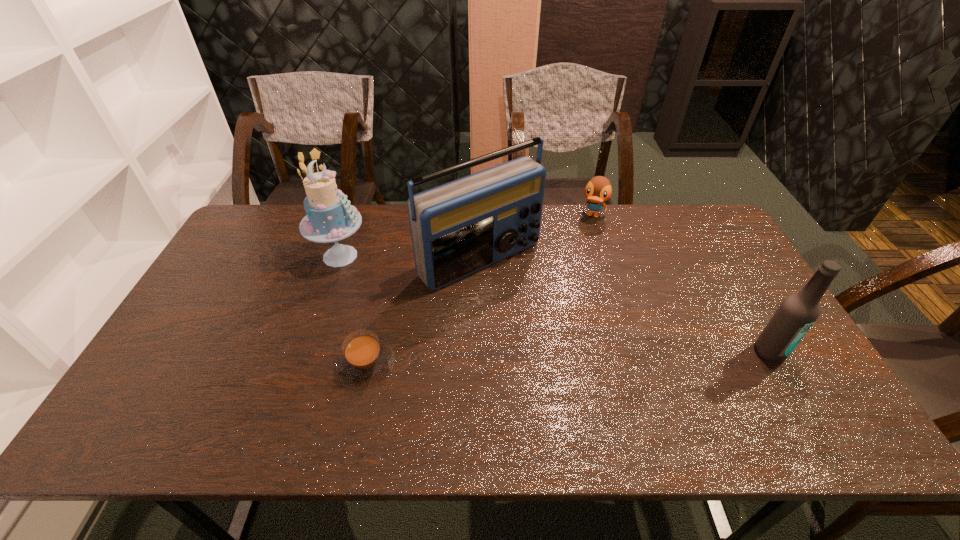
This screenshot has height=540, width=960. Find the location of `vacant area situated on the front panel of the radio receiver`. vacant area situated on the front panel of the radio receiver is located at coordinates (601, 369).

I want to click on vacant point located on the front panel of the radio receiver, so 561,331.

The width and height of the screenshot is (960, 540). What are the coordinates of `free space located with a ladder on the side of the cake` in the screenshot? It's located at (406, 292).

Where is `vacant area situated with a ladder on the side of the cake`? The width and height of the screenshot is (960, 540). vacant area situated with a ladder on the side of the cake is located at coordinates (424, 302).

Image resolution: width=960 pixels, height=540 pixels. Identify the location of vacant space located with a ladder on the side of the cake. (424, 302).

Where is `vacant space located on the front-facing side of the farthest object`? vacant space located on the front-facing side of the farthest object is located at coordinates (566, 288).

The width and height of the screenshot is (960, 540). I want to click on vacant space located on the front-facing side of the farthest object, so click(x=563, y=300).

The height and width of the screenshot is (540, 960). I want to click on vacant region located on the front-facing side of the farthest object, so click(x=582, y=250).

Where is `radio receiver present at the far edge`? The height and width of the screenshot is (540, 960). radio receiver present at the far edge is located at coordinates (458, 228).

Locate an element on the screen. The height and width of the screenshot is (540, 960). cake present at the far edge is located at coordinates (330, 217).